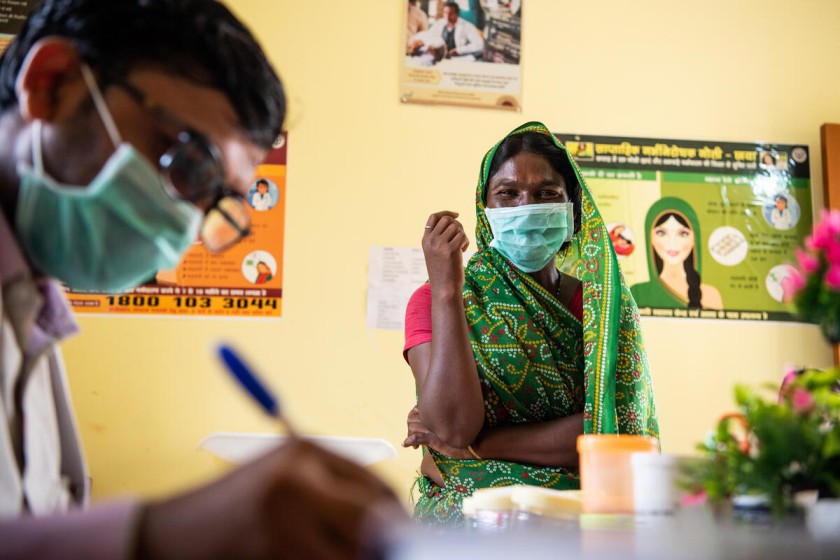
The height and width of the screenshot is (560, 840). What are the coordinates of `wall` in the screenshot? It's located at (326, 353).